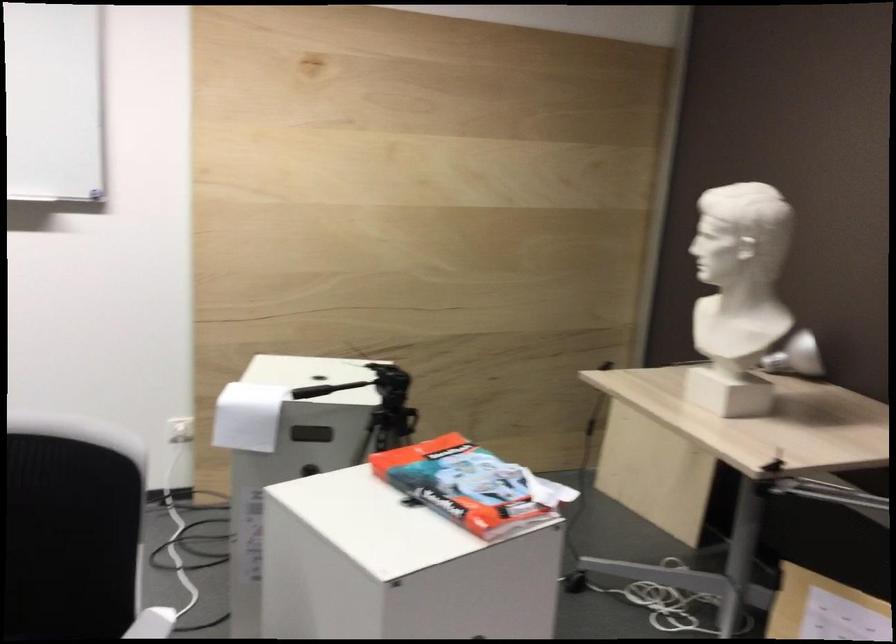
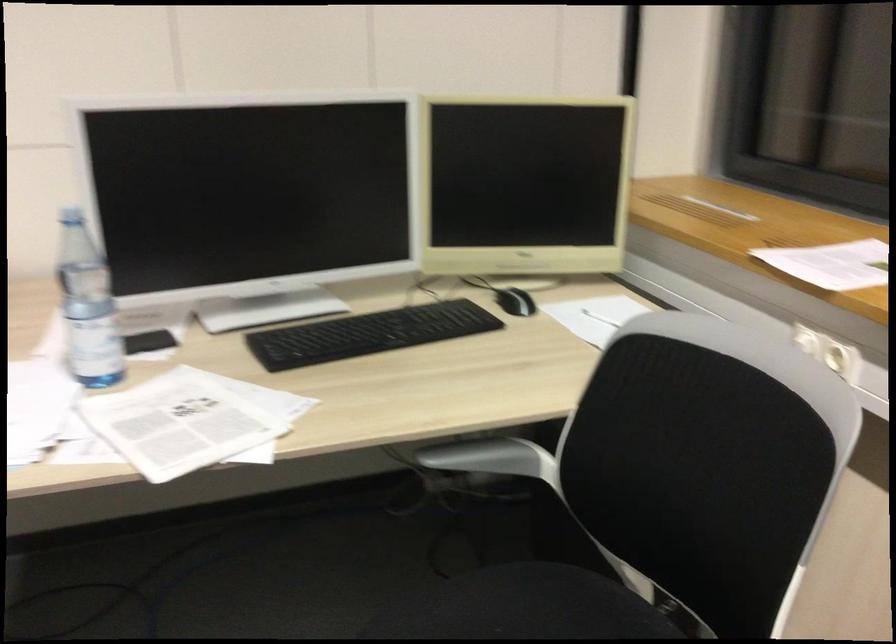
First-person continuous shooting, in which direction is the camera rotating?

The camera's rotation is toward right-down.